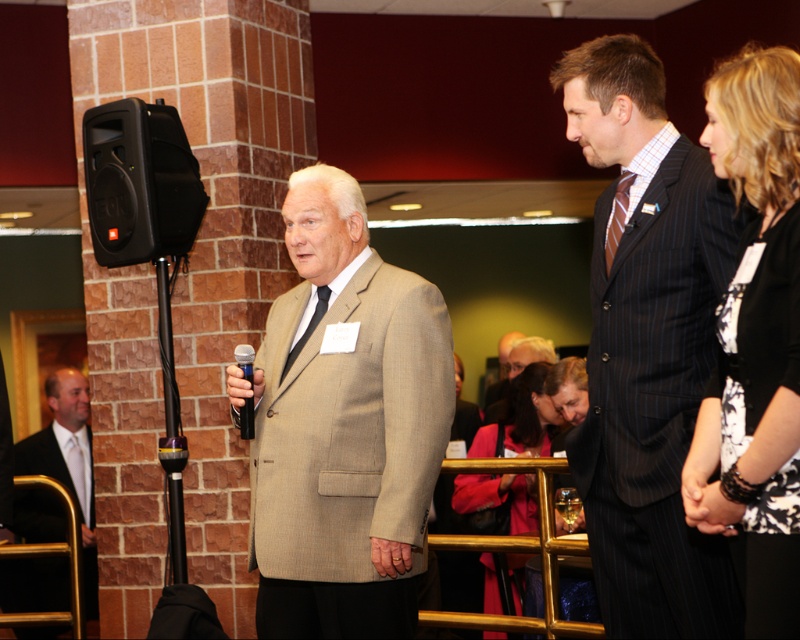
Question: Is dark pinstripe suit at center to the left of striped silk tie at center from the viewer's perspective?

Choices:
 (A) no
 (B) yes

Answer: (A)

Question: Which is farther from the black plastic speaker at left?

Choices:
 (A) matte pink coat at center
 (B) black and white floral dress at center

Answer: (A)

Question: Does dark pinstripe suit at center have a greater width compared to black suit at left?

Choices:
 (A) yes
 (B) no

Answer: (B)

Question: Which object appears farthest from the camera in this image?

Choices:
 (A) black silk tie at center
 (B) black suit at left
 (C) matte pink coat at center
 (D) black and white floral dress at center

Answer: (B)

Question: Which of the following is the farthest from the observer?

Choices:
 (A) black silk tie at center
 (B) striped silk tie at center
 (C) black plastic microphone at center

Answer: (A)

Question: Is the position of black and white floral dress at center more distant than that of matte pink coat at center?

Choices:
 (A) yes
 (B) no

Answer: (B)